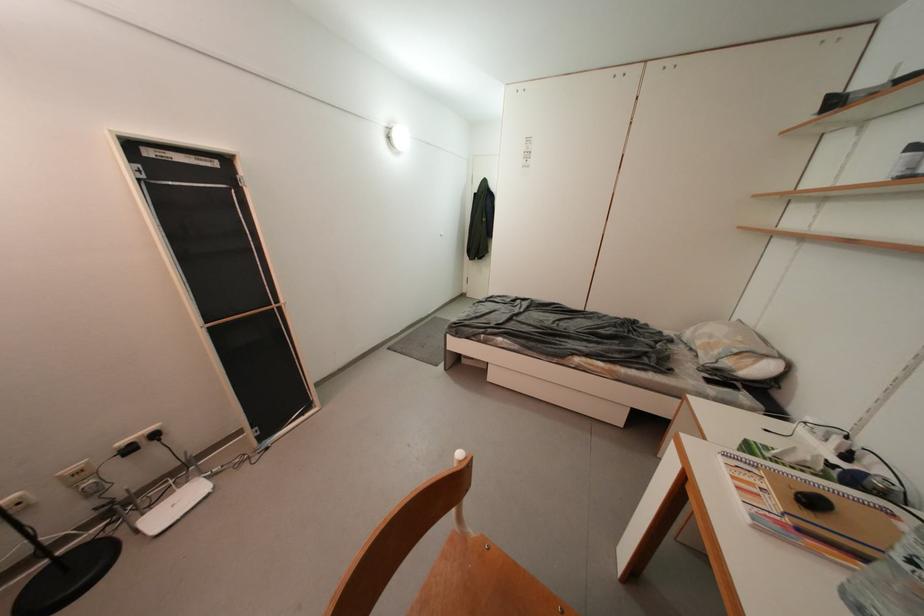
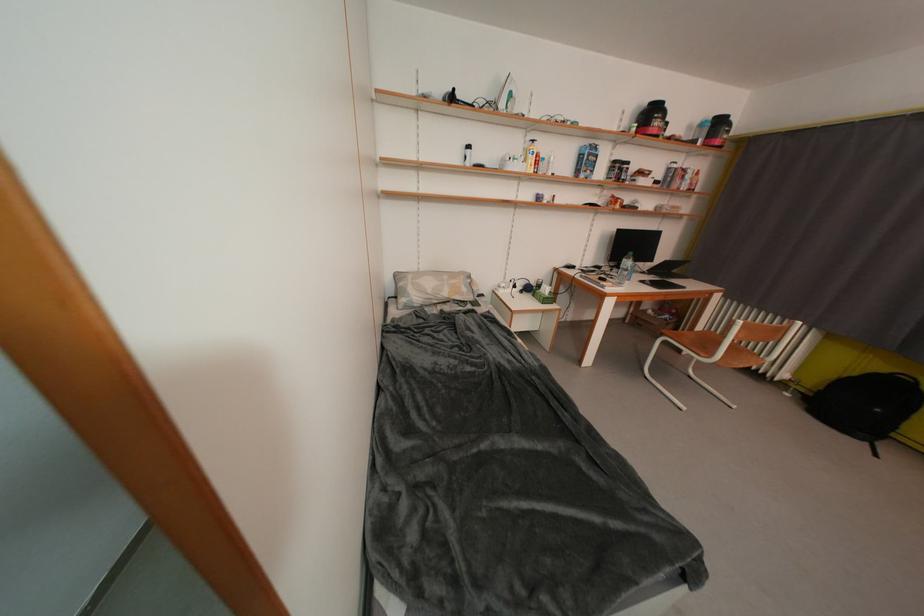
In the second image, find the point that corresponds to point 723,355 in the first image.

(471, 293)